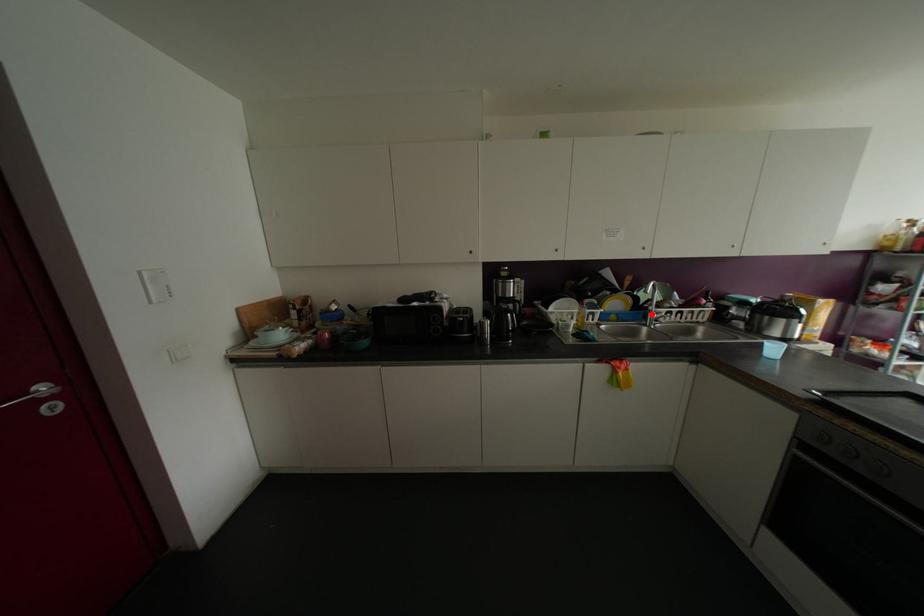
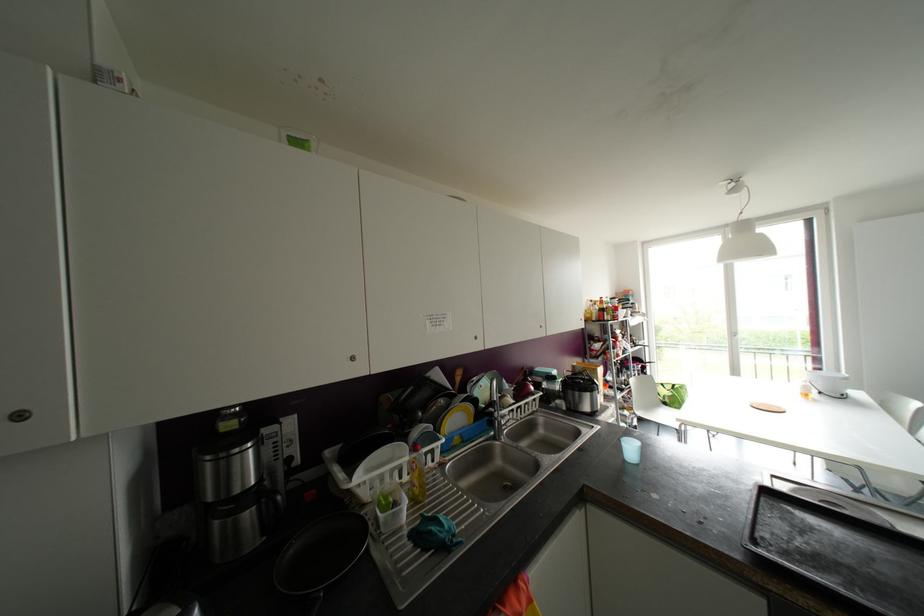
Locate, in the second image, the point that corresponds to the highlighted location in the first image.

(499, 422)